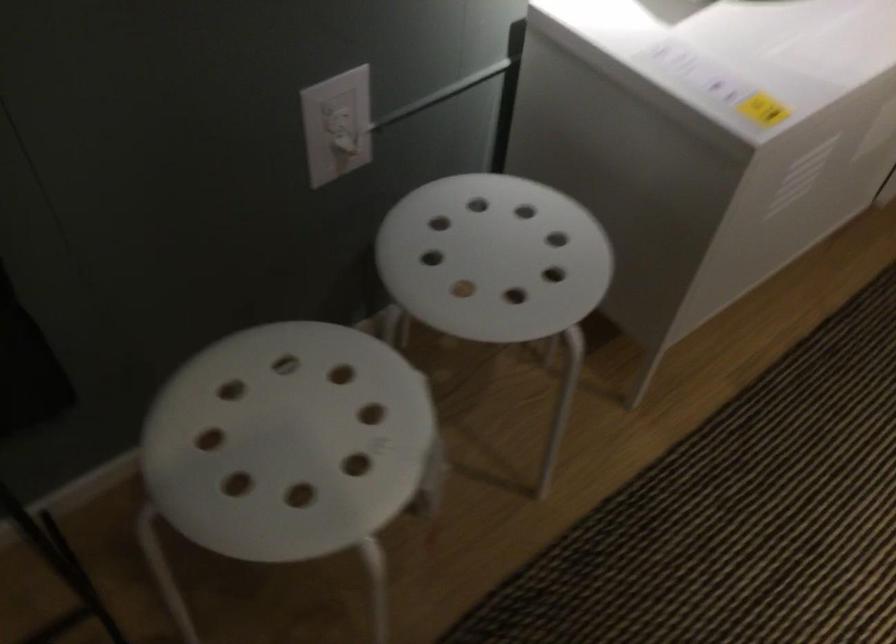
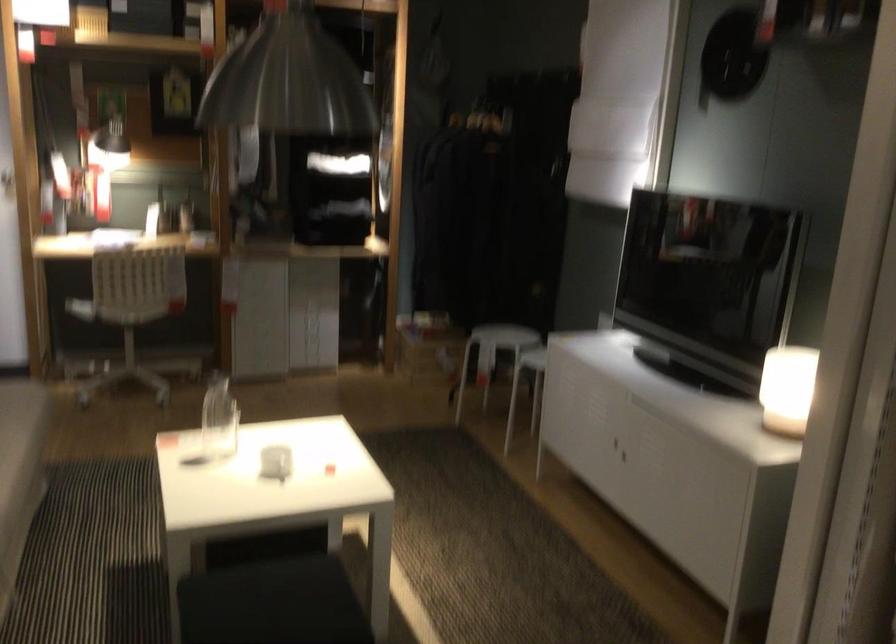
Locate, in the second image, the point that corresponds to [440,478] in the first image.

(492, 355)